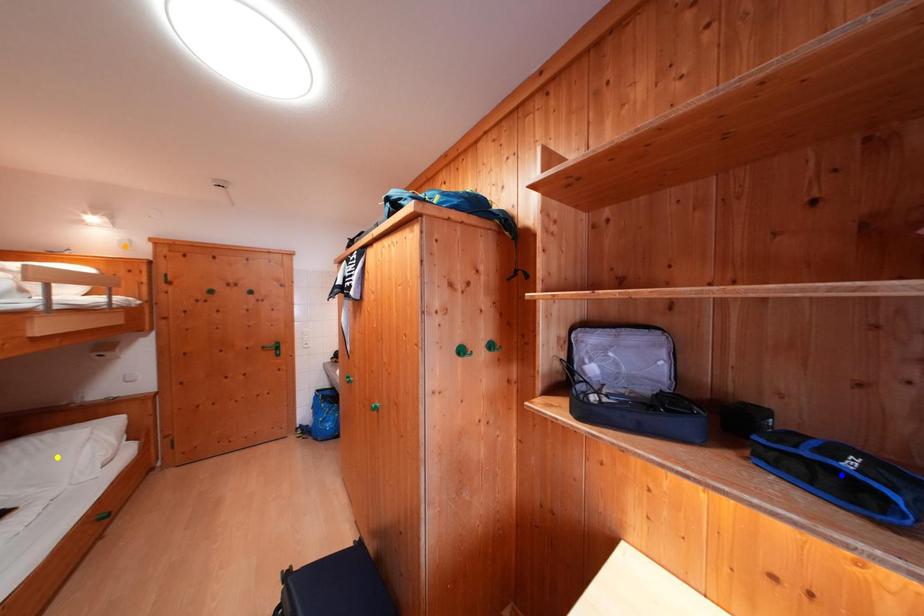
From the picture: Order these from nearest to farthest:
orange point
yellow point
blue point

orange point → yellow point → blue point